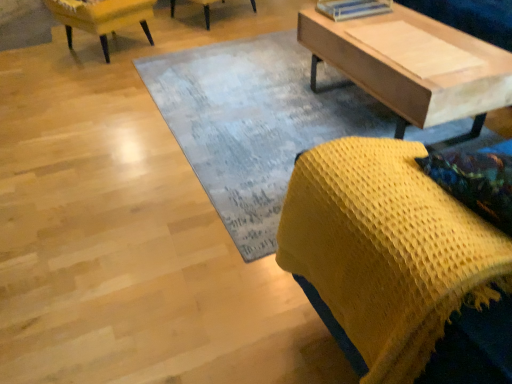
Find the location of a particular element. vacant space in light wood coffee table at upper right (from a real-world perspective) is located at coordinates (357, 107).